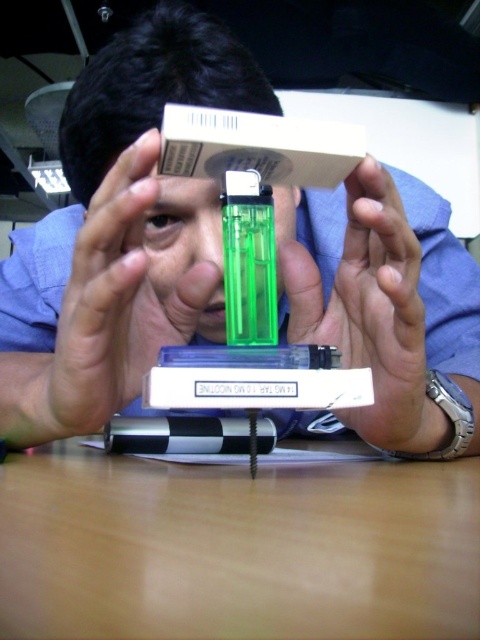
Question: Which point is farther from the camera taking this photo?

Choices:
 (A) (66, 371)
 (B) (70, 97)
 (C) (119, 77)
 (D) (275, 508)

Answer: (B)

Question: Can you confirm if green plastic head at center is bigger than green plastic lighter at center?

Choices:
 (A) yes
 (B) no

Answer: (A)

Question: Based on their relative distances, which object is farther from the transparent plastic lighter at center?

Choices:
 (A) matte green plastic hand at center
 (B) brown matte table at center

Answer: (B)

Question: Is matte green plastic hand at center to the right of green plastic head at center from the viewer's perspective?

Choices:
 (A) no
 (B) yes

Answer: (A)

Question: Is brown matte table at center bigger than matte green plastic lighter at center?

Choices:
 (A) yes
 (B) no

Answer: (A)

Question: Estimate the real-world distances between objects in this image. Which object is farther from the green plastic lighter at center?

Choices:
 (A) brown matte table at center
 (B) matte green plastic hand at center
 (C) matte green plastic lighter at center

Answer: (A)